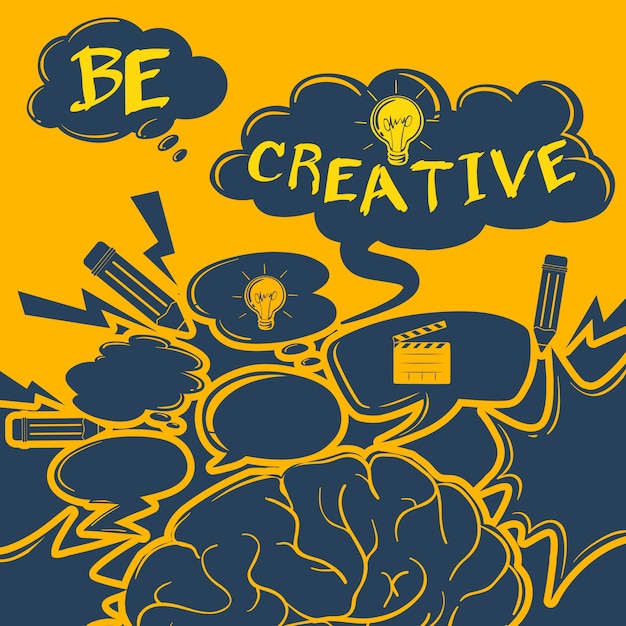
Identify the location of light bulb. (399, 120), (270, 285).